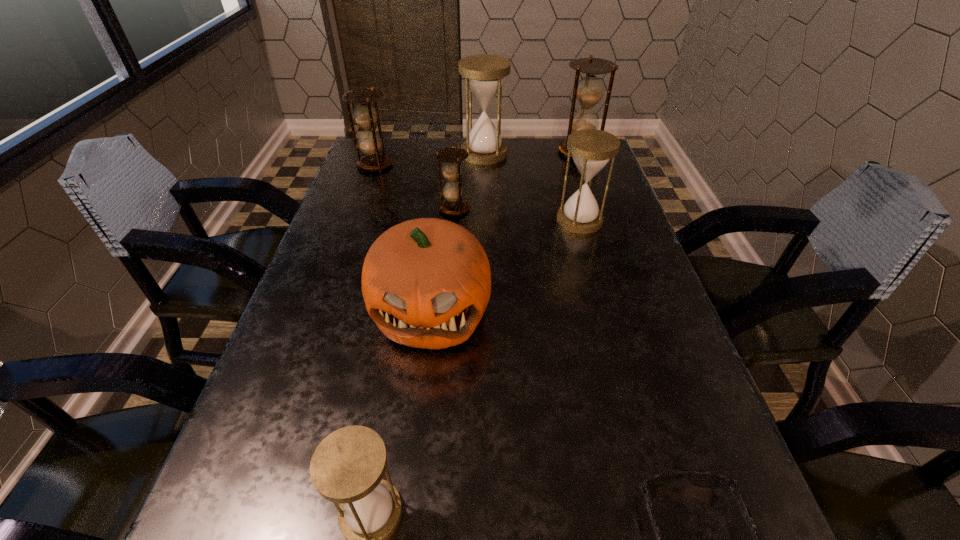
Identify the location of vacant space located on the left of the second white hourglass from right to left. (362, 153).

Find the location of a particular element. The width and height of the screenshot is (960, 540). vacant space located on the left of the rightmost brown hourglass is located at coordinates (501, 152).

In order to click on vacant area located 0.310m on the right of the leftmost object in this screenshot , I will do `click(496, 165)`.

Locate an element on the screen. vacant space located 0.140m on the left of the rightmost white hourglass is located at coordinates (502, 220).

Where is `vacant space located 0.220m on the face of the pumpkin`? This screenshot has height=540, width=960. vacant space located 0.220m on the face of the pumpkin is located at coordinates (412, 482).

In order to click on free space located 0.260m on the left of the smallest brown hourglass in this screenshot , I will do `click(339, 209)`.

Where is `hourglass that is at the left edge`? The height and width of the screenshot is (540, 960). hourglass that is at the left edge is located at coordinates (365, 115).

Image resolution: width=960 pixels, height=540 pixels. I want to click on pumpkin that is at the left edge, so click(x=426, y=283).

Locate an element on the screen. Image resolution: width=960 pixels, height=540 pixels. object that is at the far left corner is located at coordinates (365, 115).

This screenshot has width=960, height=540. In order to click on object situated at the far right corner in this screenshot , I will do `click(589, 90)`.